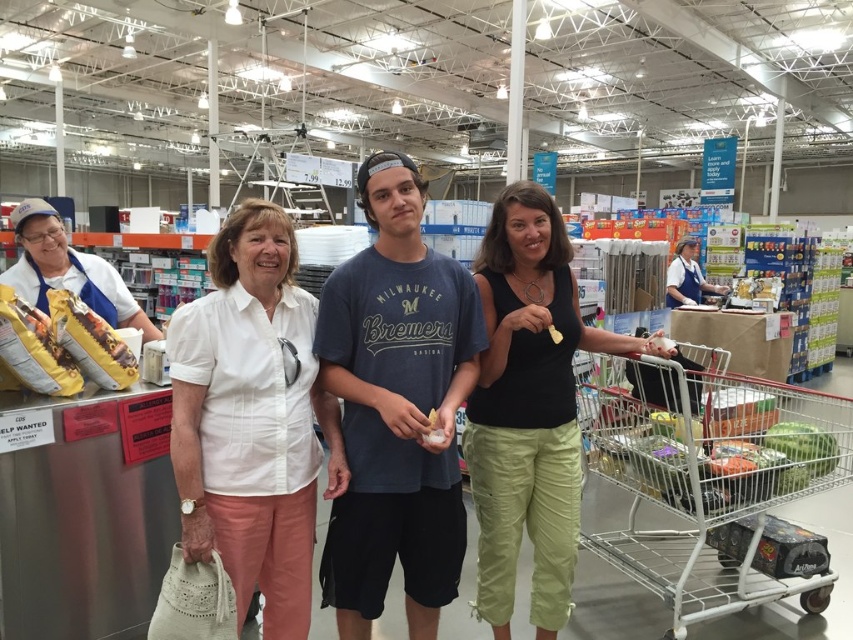
Can you confirm if white cotton blouse at center is positioned to the right of matte yellow cheese at center?

No, white cotton blouse at center is not to the right of matte yellow cheese at center.

Is white cotton blouse at center shorter than matte yellow cheese at center?

In fact, white cotton blouse at center may be taller than matte yellow cheese at center.

This screenshot has width=853, height=640. In order to click on white cotton blouse at center in this screenshot , I will do `click(252, 419)`.

Identify the location of white cotton shirt at center. The height and width of the screenshot is (640, 853). (396, 413).

Where is `white cotton shirt at center`? This screenshot has width=853, height=640. white cotton shirt at center is located at coordinates (396, 413).

Where is `white cotton shirt at center`? white cotton shirt at center is located at coordinates (396, 413).

Can you confirm if white cotton blouse at center is positioned to the right of white metal shopping cart at lower right?

Incorrect, white cotton blouse at center is not on the right side of white metal shopping cart at lower right.

Can you confirm if white cotton blouse at center is taller than white metal shopping cart at lower right?

Yes, white cotton blouse at center is taller than white metal shopping cart at lower right.

Describe the element at coordinates (252, 419) in the screenshot. Image resolution: width=853 pixels, height=640 pixels. I see `white cotton blouse at center` at that location.

Where is `white cotton blouse at center`? The height and width of the screenshot is (640, 853). white cotton blouse at center is located at coordinates (252, 419).